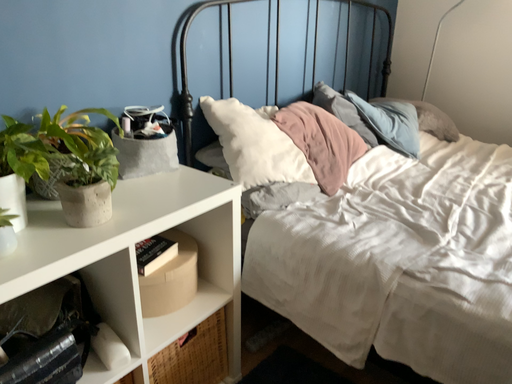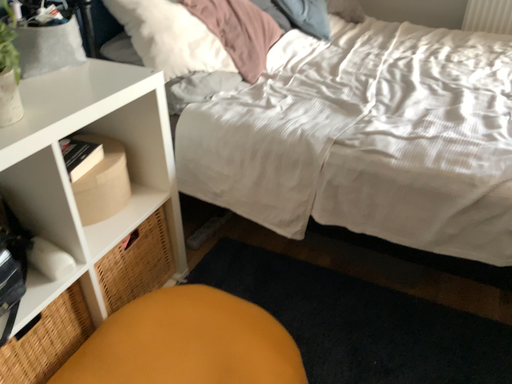
Question: How did the camera likely rotate when shooting the video?

Choices:
 (A) rotated downward
 (B) rotated upward

Answer: (A)